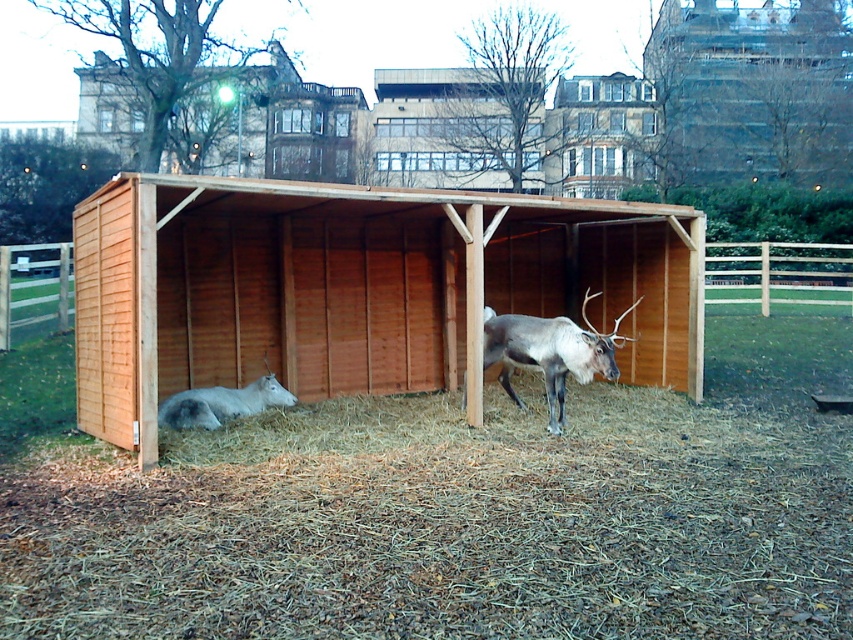
You are standing at the entrance of the brown wooden hut at upper center. Looking towards the direction of the shelter, where would you see the residential apartments in the background?

The residential apartments are located in the background behind the brown wooden hut at upper center.

You are a visitor at the park and want to take a photo of the brown wooden hut at upper center without the white fur at lower left in the frame. Based on their positions, is it possible to do so?

The brown wooden hut at upper center is located above the white fur at lower left, so you can position yourself to take a photo of the brown wooden hut at upper center without including the white fur at lower left in the frame by angling the camera upwards or moving to a higher vantage point.

You are a visitor at the park and want to take a photo of the brown wooden barn at center and the brown wooden hut at upper center. Which one is located to the left of the other?

The brown wooden barn at center is positioned on the left side of the brown wooden hut at upper center, so the barn is to the left of the hut.